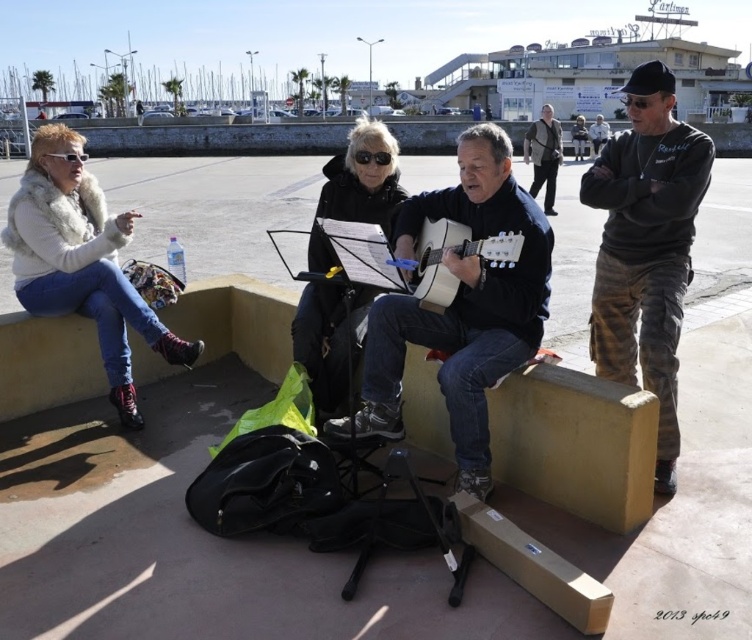
You are standing in front of the performers at the waterfront promenade. You notice two points marked in the scene. Which point, point (610, 342) or point (314, 298), is closer to you?

Point (610, 342) is closer to you than point (314, 298).

You are a street performer carrying a 3.5 feet long instrument case. You need to place it between the matte black guitar at center and the fuzzy white fur vest at left without moving either object. Is there enough space?

The distance between the matte black guitar at center and the fuzzy white fur vest at left is 5.37 feet. Since the instrument case is 3.5 feet long, there is sufficient space to place it between them.